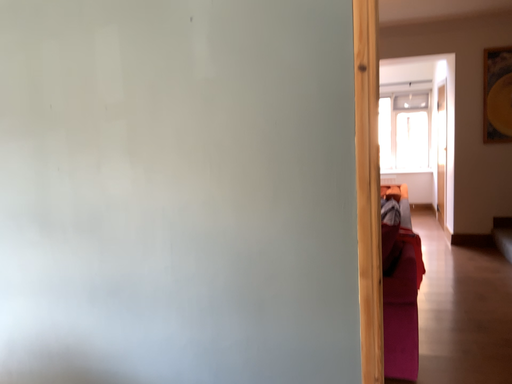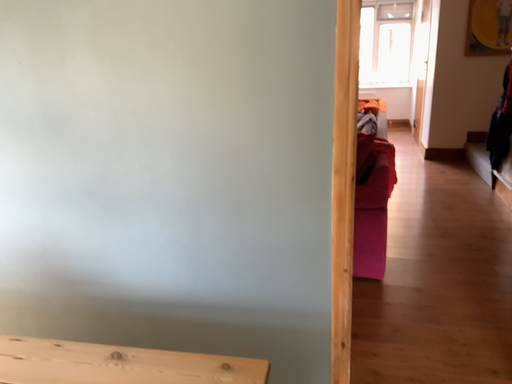
Question: Which way did the camera rotate in the video?

Choices:
 (A) rotated upward
 (B) rotated downward

Answer: (B)